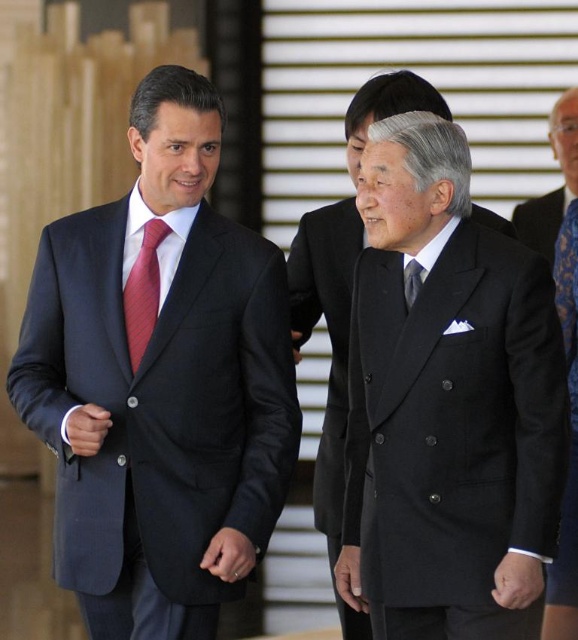
Is black woolen suit at center in front of black wool suit at center?

Yes, it is in front of black wool suit at center.

Is point (355, 352) positioned behind point (339, 385)?

No, it is in front of (339, 385).

Between point (438, 260) and point (313, 209), which one is positioned in front?

Point (438, 260) is more forward.

Find the location of a particular element. The height and width of the screenshot is (640, 578). black woolen suit at center is located at coordinates (453, 426).

Is matte black suit at left positioned at the back of black silk suit at center?

No, matte black suit at left is closer to the viewer.

From the picture: Does matte black suit at left have a greater width compared to black silk suit at center?

Correct, the width of matte black suit at left exceeds that of black silk suit at center.

Locate an element on the screen. The image size is (578, 640). matte black suit at left is located at coordinates (161, 385).

Image resolution: width=578 pixels, height=640 pixels. I want to click on matte black suit at left, so click(x=161, y=385).

Which is in front, point (436, 598) or point (291, 253)?

Point (436, 598) is more forward.

Where is `black woolen suit at center`? Image resolution: width=578 pixels, height=640 pixels. black woolen suit at center is located at coordinates (453, 426).